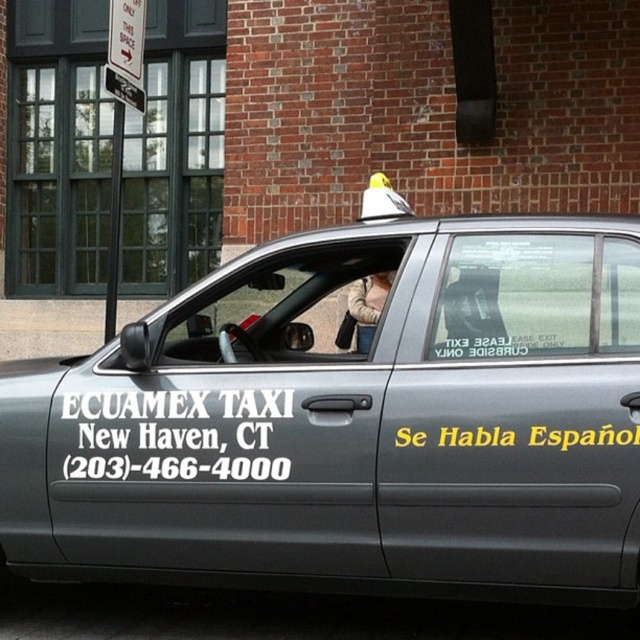
Question: Does metallic gray taxi at center have a lesser width compared to beige fuzzy jacket at center?

Choices:
 (A) no
 (B) yes

Answer: (A)

Question: Which point is farther to the camera?

Choices:
 (A) beige fuzzy jacket at center
 (B) metallic gray taxi at center

Answer: (A)

Question: Does metallic gray taxi at center have a smaller size compared to beige fuzzy jacket at center?

Choices:
 (A) no
 (B) yes

Answer: (A)

Question: Does metallic gray taxi at center have a lesser width compared to beige fuzzy jacket at center?

Choices:
 (A) yes
 (B) no

Answer: (B)

Question: Which point is closer to the camera?

Choices:
 (A) metallic gray taxi at center
 (B) beige fuzzy jacket at center

Answer: (A)